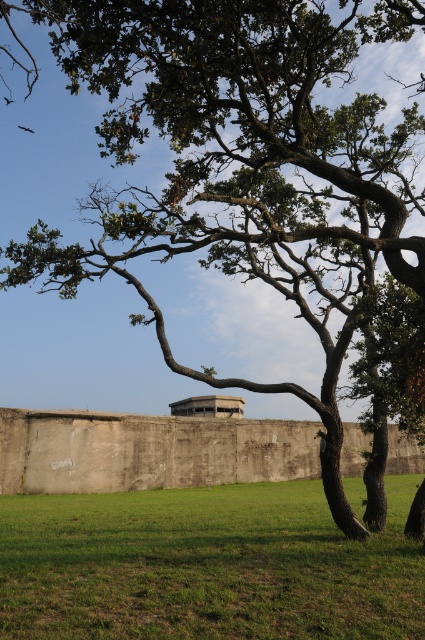
Question: Can you confirm if green grass at center is bigger than concrete wall at center?

Choices:
 (A) yes
 (B) no

Answer: (A)

Question: Observing the image, what is the correct spatial positioning of green grass at center in reference to concrete wall at center?

Choices:
 (A) right
 (B) left

Answer: (B)

Question: Considering the relative positions of green grass at center and concrete wall at center in the image provided, where is green grass at center located with respect to concrete wall at center?

Choices:
 (A) left
 (B) right

Answer: (A)